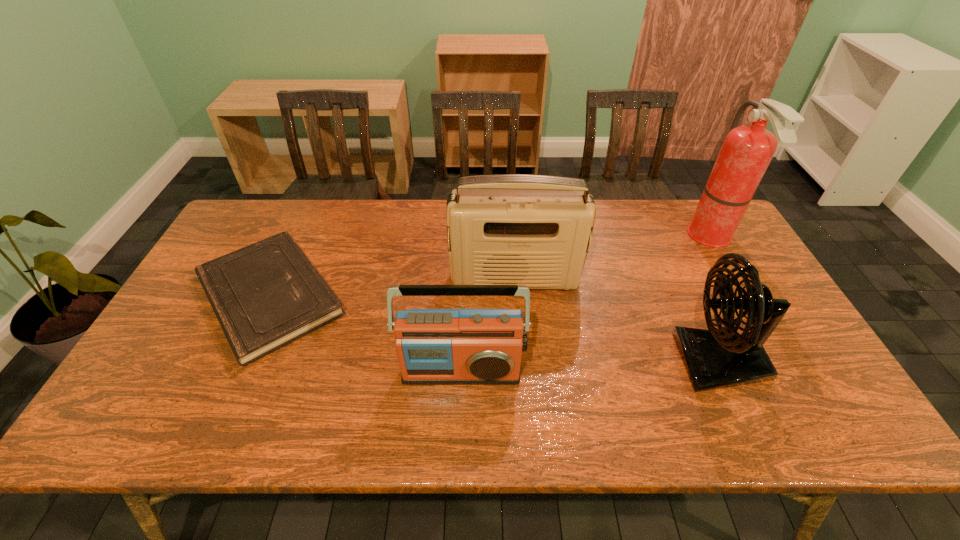
The image size is (960, 540). I want to click on fire extinguisher located in the right edge section of the desktop, so click(747, 150).

Where is `fan at the right edge`? fan at the right edge is located at coordinates [715, 358].

Identify the location of object that is at the far left corner. The height and width of the screenshot is (540, 960). tap(266, 295).

You are a GUI agent. You are given a task and a screenshot of the screen. Output one action in this format:
    pyautogui.click(x=<x>, y=<y>)
    Task: Click on the object positioned at the far right corner
    The height and width of the screenshot is (540, 960).
    Given the screenshot: What is the action you would take?
    pyautogui.click(x=747, y=150)

Where is `object situated at the near right corner`? object situated at the near right corner is located at coordinates (715, 358).

Where is `free space at the far edge of the desktop`? This screenshot has width=960, height=540. free space at the far edge of the desktop is located at coordinates pos(649,213).

In the image, there is a desktop. Where is `vacant area at the near edge`? vacant area at the near edge is located at coordinates (382, 435).

Image resolution: width=960 pixels, height=540 pixels. Find the location of `blank area at the right edge`. blank area at the right edge is located at coordinates [796, 354].

Where is `vacant space at the far left corner`? This screenshot has width=960, height=540. vacant space at the far left corner is located at coordinates (253, 240).

Identify the location of vacant space at the near right corner of the desktop. (768, 404).